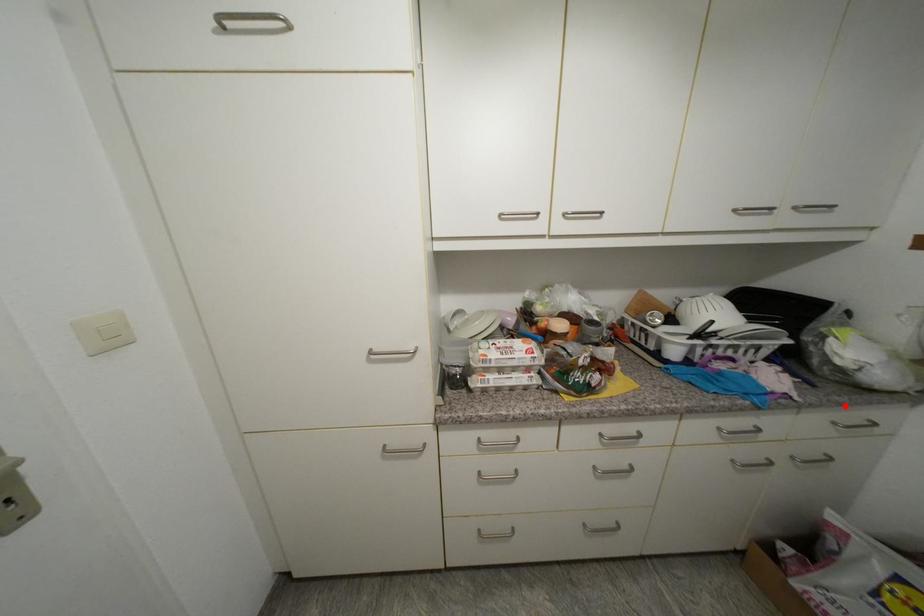
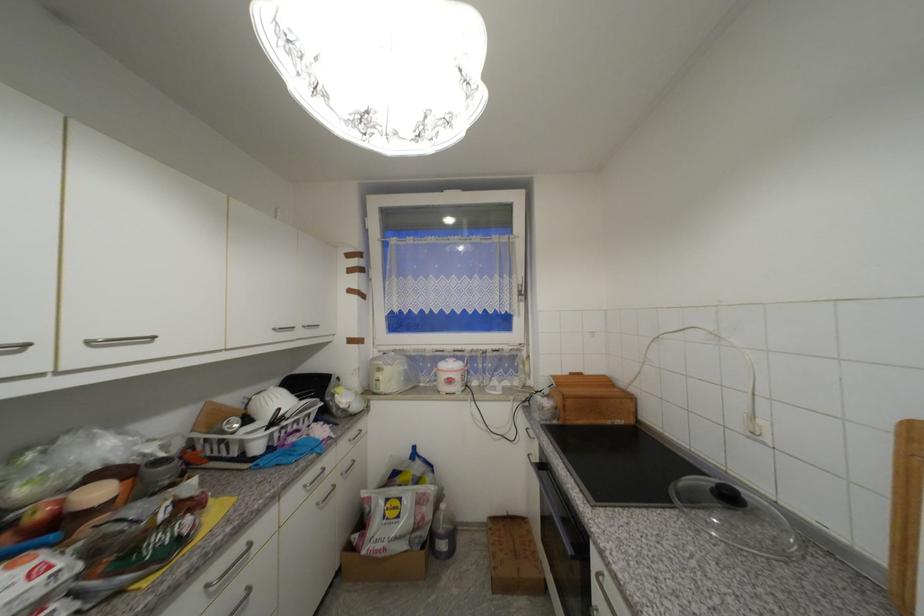
Where in the second image is the point corresponding to the highlighted location from the first image?

(354, 430)